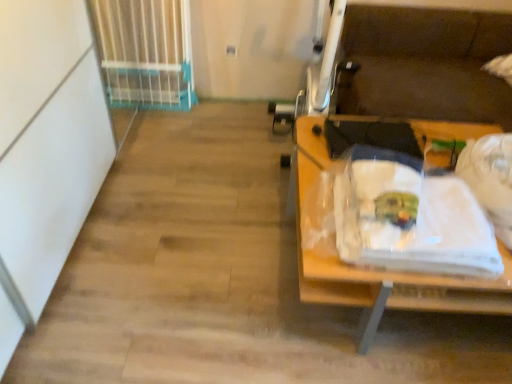
Question: Would you say white plastic gate at upper left is inside or outside white fabric at right?

Choices:
 (A) inside
 (B) outside

Answer: (B)

Question: From the image's perspective, is white plastic gate at upper left located above or below white fabric at right?

Choices:
 (A) above
 (B) below

Answer: (A)

Question: Estimate the real-world distances between objects in this image. Which object is farther from the white fabric at right?

Choices:
 (A) wooden desk at right
 (B) white plastic gate at upper left

Answer: (B)

Question: Estimate the real-world distances between objects in this image. Which object is farther from the wooden desk at right?

Choices:
 (A) white fabric at right
 (B) white plastic gate at upper left

Answer: (B)